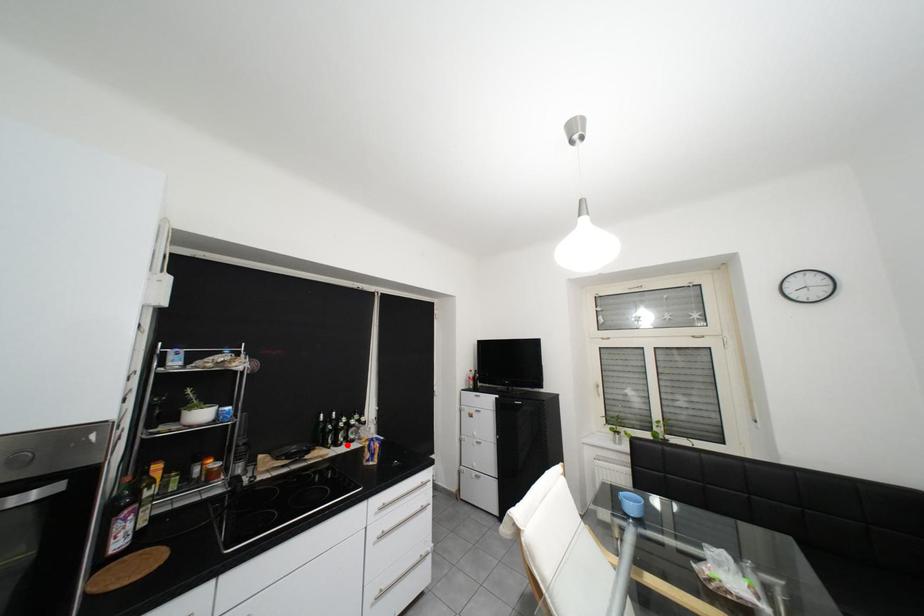
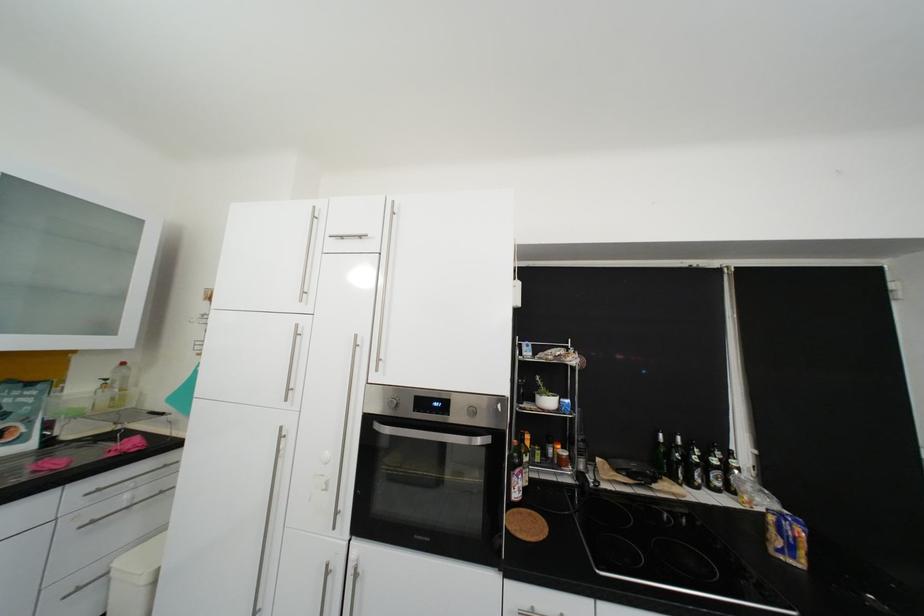
The point at the highlighted location is marked in the first image. Where is the corresponding point in the second image?

(701, 485)